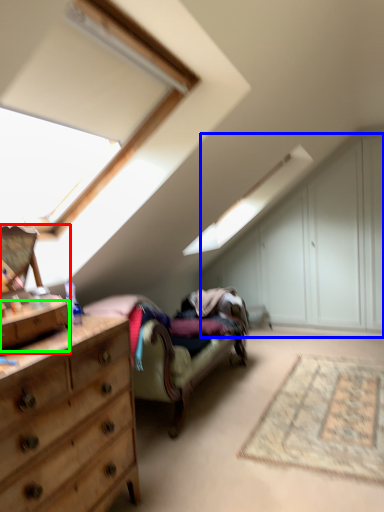
Question: Which object is the closest to the cabinetry (highlighted by a red box)? Choose among these: dresser (highlighted by a blue box) or drawer (highlighted by a green box).

Choices:
 (A) dresser
 (B) drawer

Answer: (B)